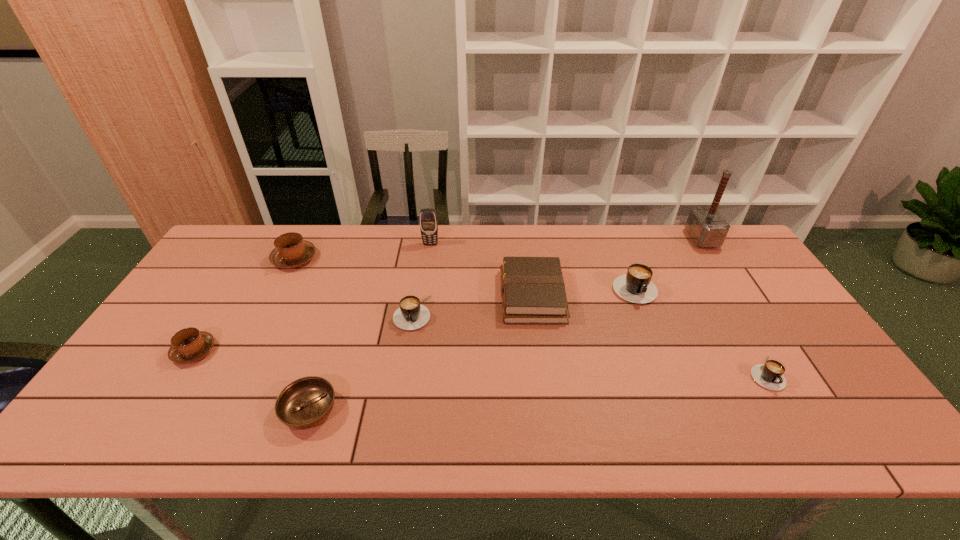
This screenshot has height=540, width=960. In order to click on the tallest object in this screenshot , I will do `click(705, 224)`.

Identify the location of brown hammer. (705, 224).

The image size is (960, 540). I want to click on cellular telephone, so click(x=428, y=219).

Locate an element on the screen. the third object from right to left is located at coordinates (635, 286).

The height and width of the screenshot is (540, 960). Find the location of `the biggest black cappuccino`. the biggest black cappuccino is located at coordinates (635, 286).

Find the location of a particular element. the farther brown cappuccino is located at coordinates (291, 251).

In order to click on the fourth cappuccino from right to left in this screenshot , I will do `click(291, 251)`.

Where is `the fourth object from right to left`? This screenshot has width=960, height=540. the fourth object from right to left is located at coordinates (533, 291).

Where is `the third cappuccino from right to left`? the third cappuccino from right to left is located at coordinates click(411, 315).

The height and width of the screenshot is (540, 960). Identify the location of the leftmost black cappuccino. (411, 315).